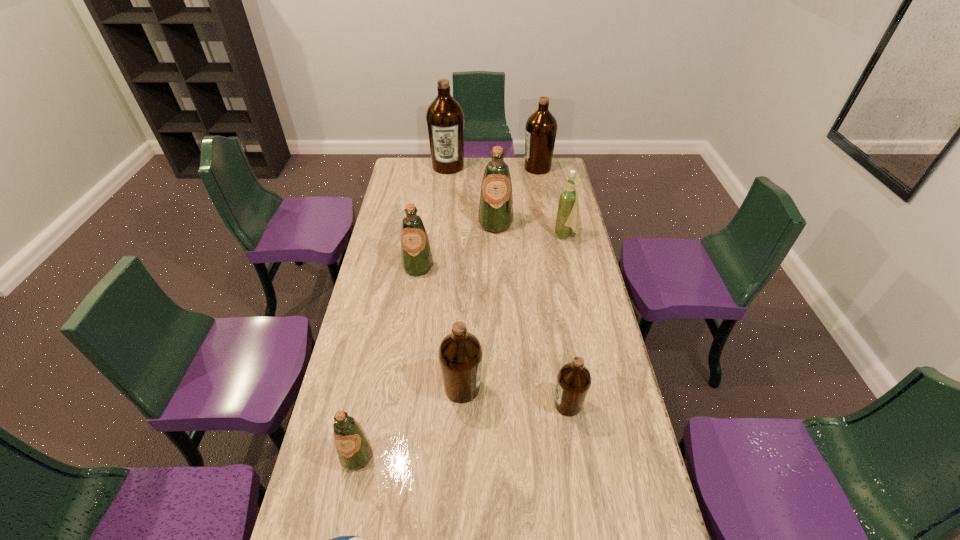
Select which object appears as the eighth closest to the smallest brown olive oil. Please provide its 2D coordinates. Your answer should be formatted as a tuple, i.e. [(x, y)], where the tuple contains the x and y coordinates of a point satisfying the conditions above.

[(445, 118)]

Locate an element on the screen. This screenshot has width=960, height=540. the closest object to the tallest object is located at coordinates (541, 127).

Where is `olive oil that is the seventh closest one to the blue baseball cap`? This screenshot has height=540, width=960. olive oil that is the seventh closest one to the blue baseball cap is located at coordinates (541, 127).

Select which olive oil is the second closest to the blue baseball cap. Please provide its 2D coordinates. Your answer should be formatted as a tuple, i.e. [(x, y)], where the tuple contains the x and y coordinates of a point satisfying the conditions above.

[(460, 353)]

Image resolution: width=960 pixels, height=540 pixels. What are the coordinates of `brown olive oil that stands as the second closest to the wine bottle` in the screenshot? It's located at (445, 118).

Locate which brown olive oil is the third closest to the second smallest brown olive oil. Please provide its 2D coordinates. Your answer should be formatted as a tuple, i.e. [(x, y)], where the tuple contains the x and y coordinates of a point satisfying the conditions above.

[(541, 127)]

Find the location of `the second closest green olive oil to the nearest object`. the second closest green olive oil to the nearest object is located at coordinates (417, 260).

Identify which green olive oil is the third closest to the tallest object. Please provide its 2D coordinates. Your answer should be formatted as a tuple, i.e. [(x, y)], where the tuple contains the x and y coordinates of a point satisfying the conditions above.

[(354, 449)]

You are a GUI agent. You are given a task and a screenshot of the screen. Output one action in this format:
    pyautogui.click(x=<x>, y=<y>)
    Task: Click on the free region that satisfies the following two spatial constraints: 1. on the front-facing side of the wine bottle; 2. on the front-facing side of the fourth nearest olive oil
    
    Given the screenshot: What is the action you would take?
    pyautogui.click(x=572, y=267)

I want to click on free location that satisfies the following two spatial constraints: 1. on the label of the second biggest brown olive oil; 2. on the front-facing side of the fourth nearest olive oil, so click(556, 267).